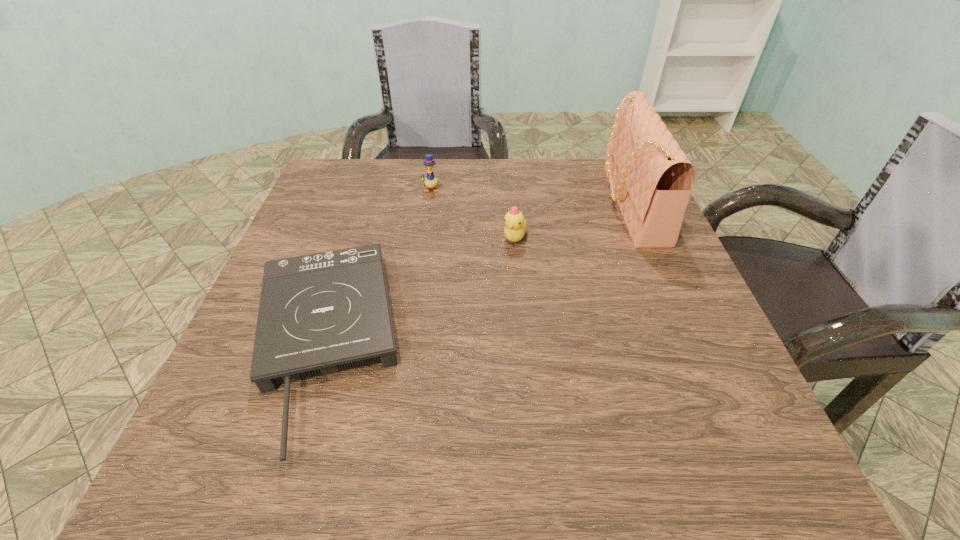
Find the location of a particular element. This screenshot has height=540, width=960. empty location between the left duckling and the right duckling is located at coordinates (472, 213).

Identify the location of empty space between the left duckling and the rightmost object. The width and height of the screenshot is (960, 540). (530, 197).

What are the coordinates of `free space between the handbag and the nearest object` in the screenshot? It's located at (475, 274).

Locate an element on the screen. vacant area that lies between the right duckling and the handbag is located at coordinates (572, 221).

Locate an element on the screen. Image resolution: width=960 pixels, height=540 pixels. free space between the second object from right to left and the shortest object is located at coordinates (419, 291).

You are a GUI agent. You are given a task and a screenshot of the screen. Output one action in this format:
    pyautogui.click(x=<x>, y=<y>)
    Task: Click on the free space between the third object from left to right and the nearest object
    
    Given the screenshot: What is the action you would take?
    pyautogui.click(x=419, y=291)

This screenshot has height=540, width=960. I want to click on the third closest object to the nearest object, so click(651, 179).

Where is `object that is the closest to the farther duckling`? object that is the closest to the farther duckling is located at coordinates (515, 224).